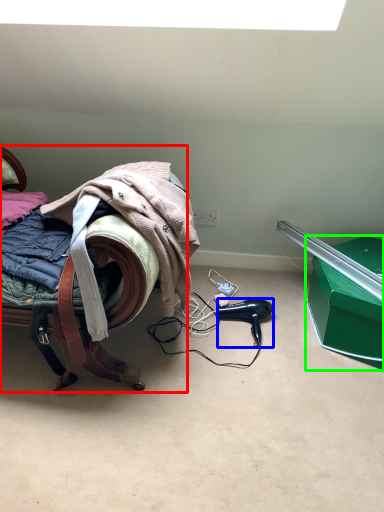
Question: Which object is positioned closest to furniture (highlighted by a red box)? Select from hair dryer (highlighted by a blue box) and box (highlighted by a green box).

Choices:
 (A) hair dryer
 (B) box

Answer: (A)